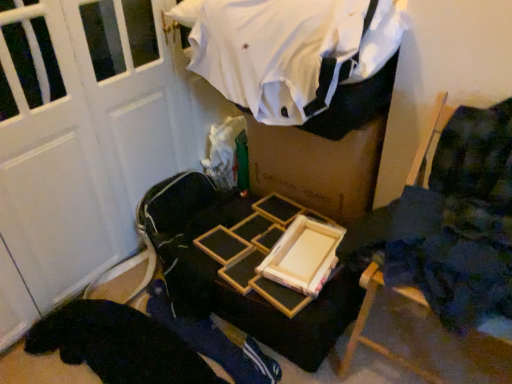
Image resolution: width=512 pixels, height=384 pixels. Identify the location of wooden frame at center. (317, 167).

In order to face wooden frame at center, should I rotate leftwards or rightwards?

Rotate right and turn 7.771 degrees.

Where is `wooden chair at right`? wooden chair at right is located at coordinates (444, 229).

Is white cotton shirt at upper center at the left side of wooden frame at center?

Yes, white cotton shirt at upper center is to the left of wooden frame at center.

Could you tell me if white cotton shirt at upper center is facing wooden frame at center?

No, white cotton shirt at upper center is not facing towards wooden frame at center.

Consider the image. From a real-world perspective, is white cotton shirt at upper center positioned under wooden frame at center based on gravity?

No, from a real-world perspective, white cotton shirt at upper center is not beneath wooden frame at center.

Find the location of a particular element. The image size is (512, 384). clothing that appears in front of the wooden frame at center is located at coordinates (290, 50).

Between wooden frame at center and white cotton shirt at upper center, which one has smaller size?

wooden frame at center.

Considering the sizes of objects wooden frame at center and white cotton shirt at upper center in the image provided, who is shorter, wooden frame at center or white cotton shirt at upper center?

Standing shorter between the two is white cotton shirt at upper center.

Choose the correct answer: Is wooden frame at center inside white cotton shirt at upper center or outside it?

wooden frame at center is spatially situated outside white cotton shirt at upper center.

Is wooden frame at center positioned before blue fabric at center?

No, wooden frame at center is behind blue fabric at center.

From the image's perspective, does wooden frame at center appear lower than blue fabric at center?

Incorrect, from the image's perspective, wooden frame at center is higher than blue fabric at center.

Who is taller, wooden frame at center or blue fabric at center?

Standing taller between the two is wooden frame at center.

From a real-world perspective, which object rests below the other?

In real-world perspective, blue fabric at center is lower.

Would you say wooden frame at center is a long distance from wooden chair at right?

No, wooden frame at center is not far away from wooden chair at right.

From a real-world perspective, is wooden frame at center physically above wooden chair at right?

No, from a real-world perspective, wooden frame at center is not over wooden chair at right

Considering the positions of point (337, 142) and point (420, 221), is point (337, 142) closer or farther from the camera than point (420, 221)?

Point (337, 142) is positioned farther from the camera compared to point (420, 221).

Is wooden frame at center located outside wooden chair at right?

wooden frame at center is positioned outside wooden chair at right.

Is white cotton shirt at upper center positioned before wooden chair at right?

No, white cotton shirt at upper center is further to the viewer.

Consider the image. Which object is wider, white cotton shirt at upper center or wooden chair at right?

Wider between the two is white cotton shirt at upper center.

Is the surface of blue fabric at center in direct contact with wooden frame at center?

No, blue fabric at center is not next to wooden frame at center.

Who is bigger, blue fabric at center or wooden frame at center?

wooden frame at center.

Is blue fabric at center wider than wooden frame at center?

Indeed, blue fabric at center has a greater width compared to wooden frame at center.

From a real-world perspective, between blue fabric at center and wooden frame at center, who is vertically lower?

blue fabric at center, from a real-world perspective.

Is white cotton shirt at upper center looking in the opposite direction of blue fabric at center?

No.

Consider the image. Is white cotton shirt at upper center bigger or smaller than blue fabric at center?

white cotton shirt at upper center is bigger than blue fabric at center.

From the image's perspective, is white cotton shirt at upper center below blue fabric at center?

No.

How much distance is there between white cotton shirt at upper center and blue fabric at center?

84.82 centimeters.

You are a GUI agent. You are given a task and a screenshot of the screen. Output one action in this format:
    pyautogui.click(x=<x>, y=<y>)
    Task: Click on the box to the right of white cotton shirt at upper center
    
    Given the screenshot: What is the action you would take?
    pyautogui.click(x=317, y=167)

The image size is (512, 384). Find the location of `clothing on the left side of wooden frame at center`. clothing on the left side of wooden frame at center is located at coordinates (290, 50).

When comparing their distances from white cotton shirt at upper center, does wooden frame at center or blue fabric at center seem further?

blue fabric at center is positioned further to the anchor white cotton shirt at upper center.

Looking at the image, which one is located further to white cotton shirt at upper center, blue fabric at center or wooden chair at right?

blue fabric at center is positioned further to the anchor white cotton shirt at upper center.

Based on their spatial positions, is wooden chair at right or blue fabric at center further from wooden frame at center?

blue fabric at center is further to wooden frame at center.

Considering their positions, is wooden chair at right positioned further to white cotton shirt at upper center than wooden frame at center?

Result: Among the two, wooden chair at right is located further to white cotton shirt at upper center.

From the image, which object appears to be farther from wooden frame at center, wooden chair at right or white cotton shirt at upper center?

wooden chair at right lies further to wooden frame at center than the other object.

Considering their positions, is wooden frame at center positioned further to blue fabric at center than white cotton shirt at upper center?

Among the two, white cotton shirt at upper center is located further to blue fabric at center.

Based on their spatial positions, is white cotton shirt at upper center or wooden frame at center further from wooden chair at right?

white cotton shirt at upper center lies further to wooden chair at right than the other object.

Based on their spatial positions, is white cotton shirt at upper center or wooden chair at right further from blue fabric at center?

white cotton shirt at upper center lies further to blue fabric at center than the other object.

Where is `box between white cotton shirt at upper center and blue fabric at center vertically`? Image resolution: width=512 pixels, height=384 pixels. box between white cotton shirt at upper center and blue fabric at center vertically is located at coordinates (317, 167).

Find the location of a particular element. Image resolution: width=512 pixels, height=384 pixels. furniture between white cotton shirt at upper center and blue fabric at center from top to bottom is located at coordinates (444, 229).

Where is `box between blue fabric at center and wooden chair at right in the horizontal direction`? The image size is (512, 384). box between blue fabric at center and wooden chair at right in the horizontal direction is located at coordinates (317, 167).

The width and height of the screenshot is (512, 384). Find the location of `box that lies between white cotton shirt at upper center and wooden chair at right from top to bottom`. box that lies between white cotton shirt at upper center and wooden chair at right from top to bottom is located at coordinates (317, 167).